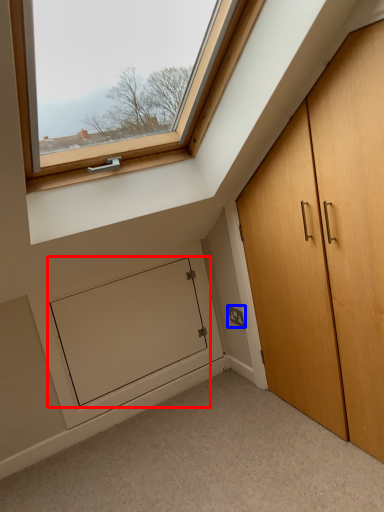
Question: Among these objects, which one is farthest to the camera, screen door (highlighted by a red box) or electric outlet (highlighted by a blue box)?

Choices:
 (A) screen door
 (B) electric outlet

Answer: (B)